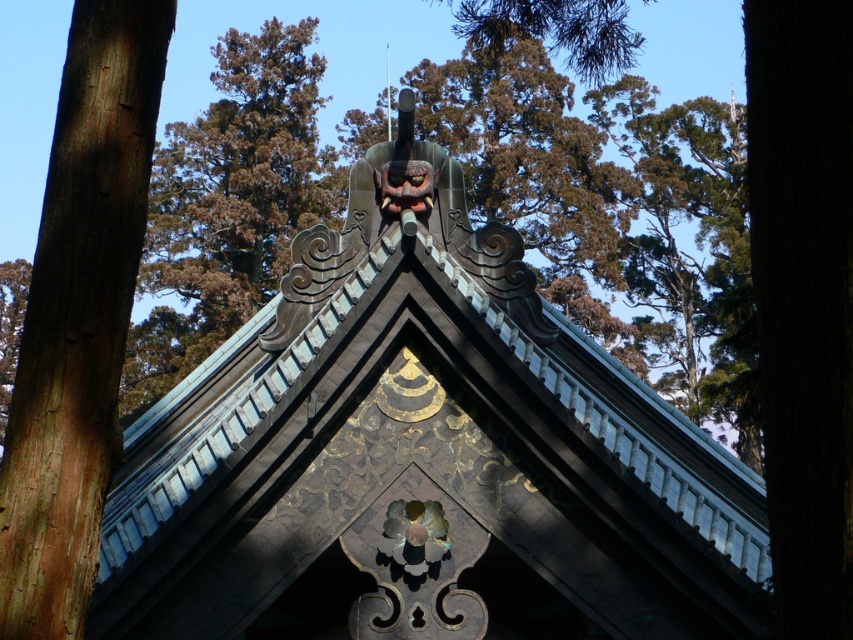
You are an architect designing a model of this traditional Japanese structure. You have two pieces of wood available for the roof details. The brown rough wood at left and the dark brown wood at right. Given their sizes, which piece would be more suitable for the larger decorative elements on the roof?

The dark brown wood at right is larger in size, making it more suitable for the larger decorative elements on the roof compared to the smaller brown rough wood at left.

You are an architect examining the roof structure of a traditional Japanese temple. You notice the brown rough wood at left and the brown wood tree at upper center. Which object is located below the other?

The brown rough wood at left is positioned under brown wood tree at upper center, so the brown rough wood at left is below the brown wood tree at upper center.

You are an architect examining the roof structure of a traditional Japanese temple. You notice two wooden elements in the scene. One is the brown rough wood at left and the other is the brown wood tree at upper center. From your vantage point, which of these wooden elements appears closer to you?

The brown rough wood at left appears closer because it is positioned in front of the brown wood tree at upper center.